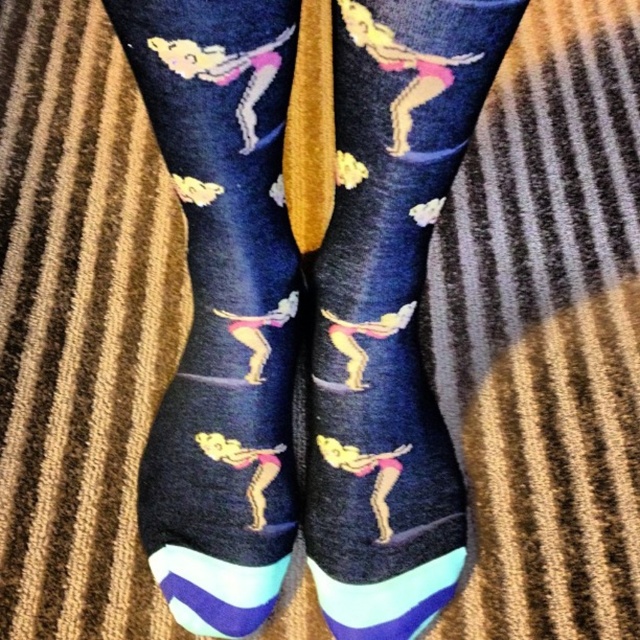
Is matte dark blue socks with colorful gymnast design at center further to camera compared to navy blue cotton socks at center?

That is False.

Measure the distance between point (342,541) and camera.

Point (342,541) is 1.02 meters away from camera.

What are the coordinates of `matte dark blue socks with colorful gymnast design at center` in the screenshot? It's located at (388, 310).